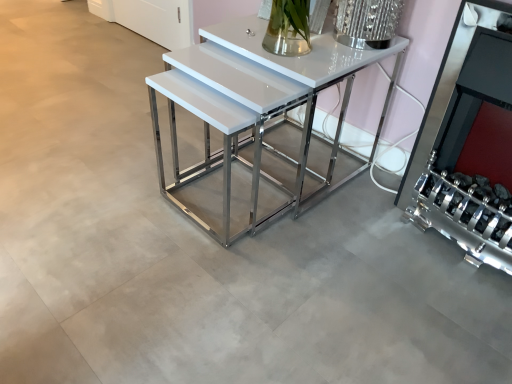
Identify the location of vacant space underneath white glossy table at center (from a real-world perspective). Image resolution: width=512 pixels, height=384 pixels. (271, 169).